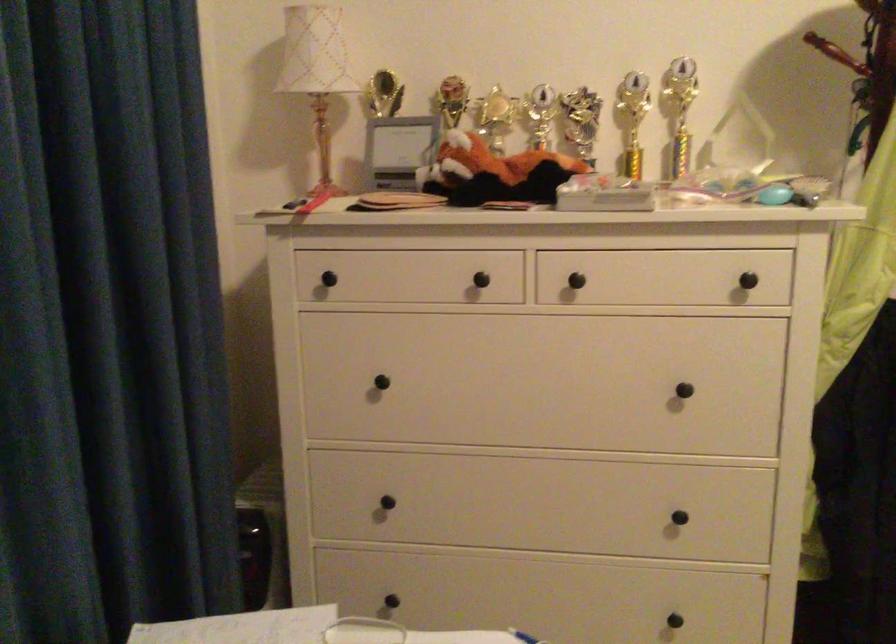
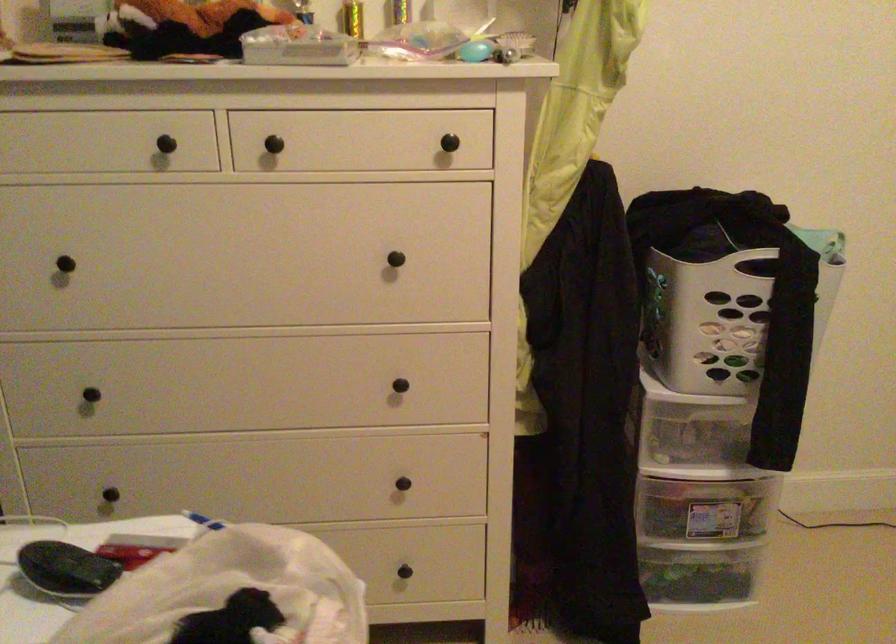
Question: I am providing you with two images of the same scene from different viewpoints. Which of the following objects are not visible in image2?

Choices:
 (A) blue oval object
 (B) laundry basket handle
 (C) black drawer knob
 (D) none of these

Answer: (D)